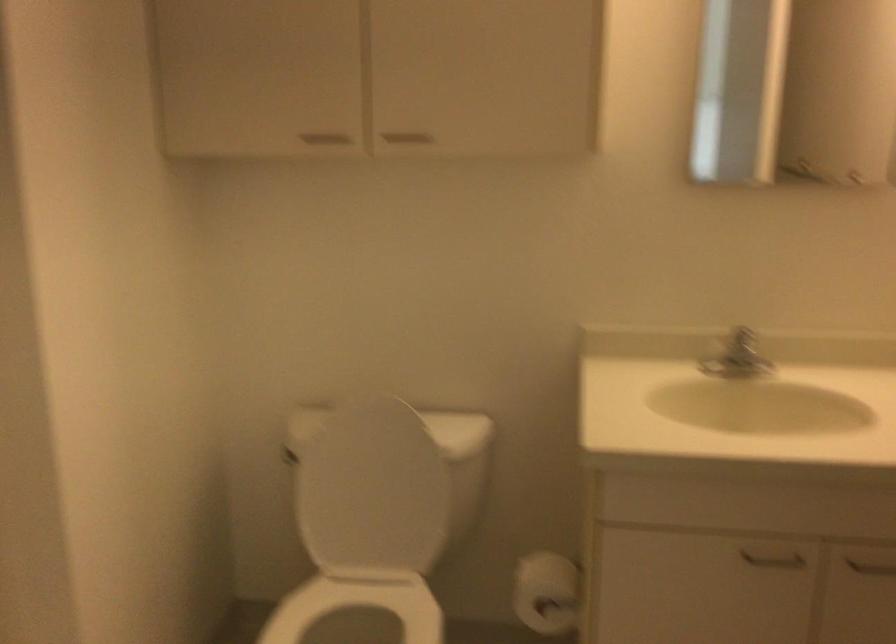
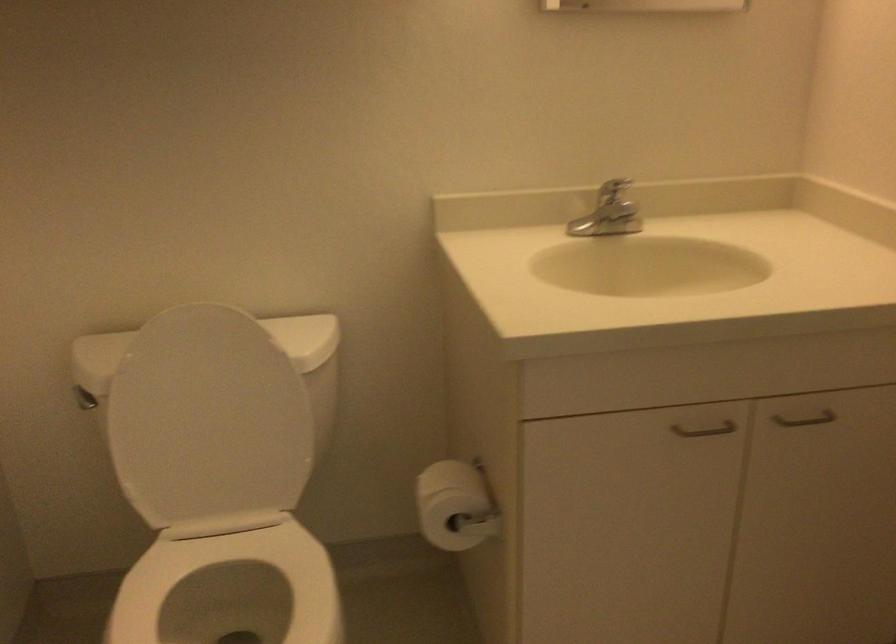
In a continuous first-person perspective shot, in which direction is the camera moving?

The movement direction of the cameraman is left, forward.